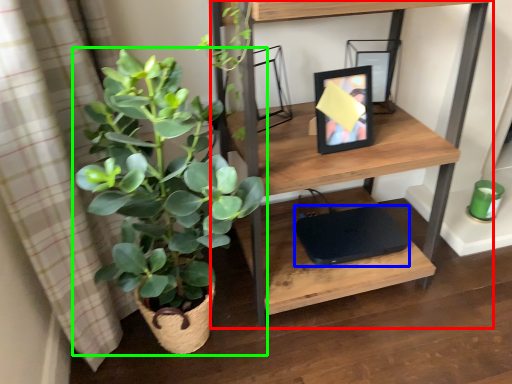
Question: Which object is positioned farthest from shelf (highlighted by a red box)? Select from computer (highlighted by a blue box) and houseplant (highlighted by a green box).

Choices:
 (A) computer
 (B) houseplant

Answer: (A)